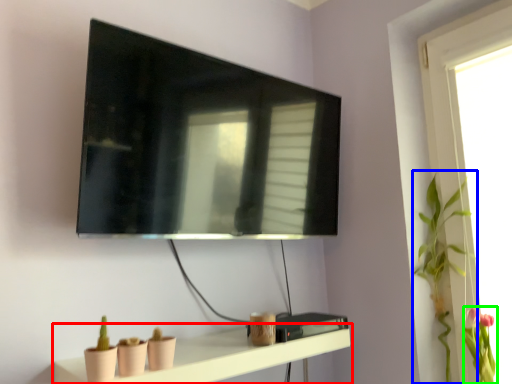
Question: Which object is positioned closest to shelf (highlighted by a red box)? Select from plant (highlighted by a blue box) and floral arrangement (highlighted by a green box).

Choices:
 (A) plant
 (B) floral arrangement

Answer: (A)